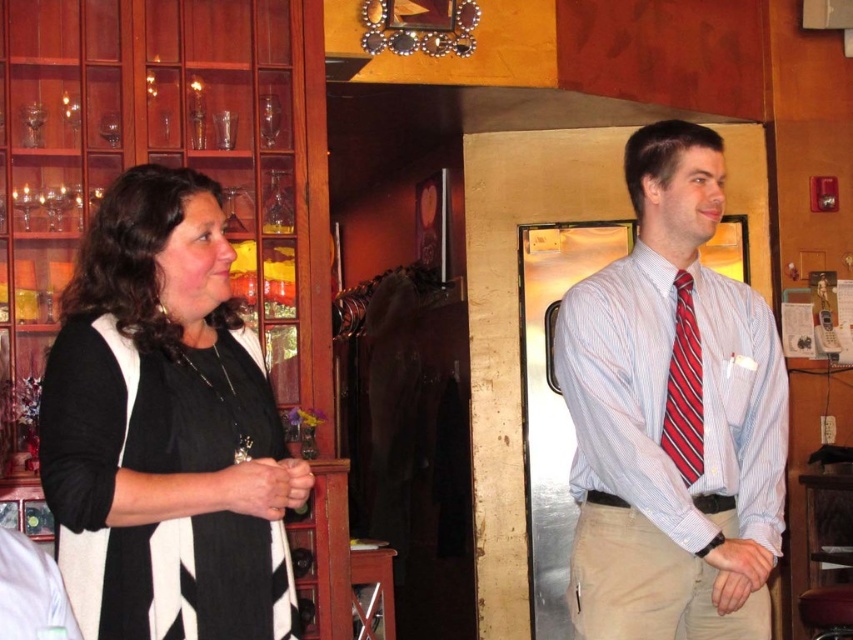
Between point (239, 604) and point (672, 355), which one is positioned in front?

Point (239, 604) is in front.

How far apart are black matte sweater at left and striped cotton shirt at right?

3.89 feet

Where is `black matte sweater at left`? The image size is (853, 640). black matte sweater at left is located at coordinates (164, 429).

Is point (701, 358) farther from camera compared to point (663, 442)?

Yes, point (701, 358) is farther from viewer.

Who is more distant from viewer, (x=624, y=406) or (x=669, y=454)?

The point (x=669, y=454) is more distant.

Which is in front, point (679, 493) or point (682, 474)?

Point (679, 493) is more forward.

You are a GUI agent. You are given a task and a screenshot of the screen. Output one action in this format:
    pyautogui.click(x=<x>, y=<y>)
    Task: Click on the striped cotton shirt at right
    
    Given the screenshot: What is the action you would take?
    pyautogui.click(x=672, y=417)

Is black matte sweater at left wider than red striped tie at right?

Yes, black matte sweater at left is wider than red striped tie at right.

Is point (225, 582) positioned behind point (691, 465)?

No, it is in front of (691, 465).

You are a GUI agent. You are given a task and a screenshot of the screen. Output one action in this format:
    pyautogui.click(x=<x>, y=<y>)
    Task: Click on the black matte sweater at left
    
    Given the screenshot: What is the action you would take?
    coord(164,429)

Identify the location of black matte sweater at left. The width and height of the screenshot is (853, 640). (164, 429).